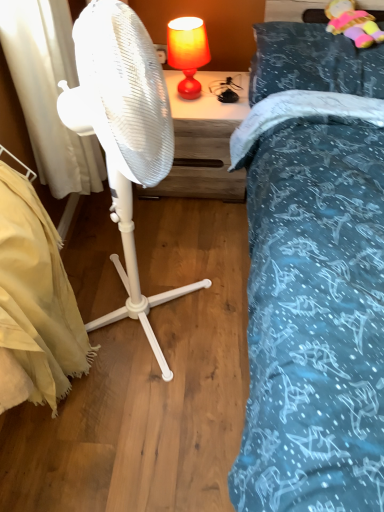
I want to click on vacant space underneath white plastic fan at center (from a real-world perspective), so coord(159,312).